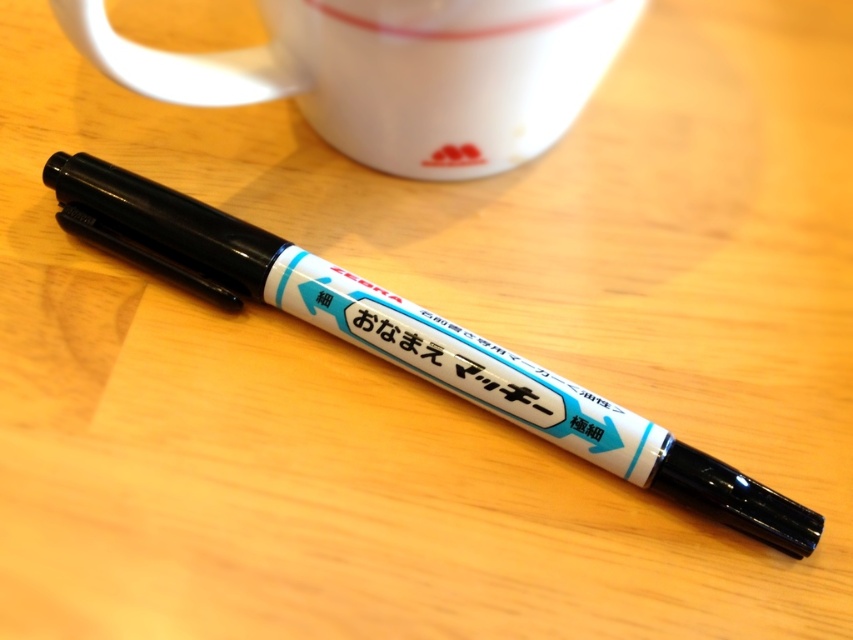
You are organizing a desk and need to place a new item between the white matte mug at upper center and the black plastic marker at center. The new item requires 14 inches of space. Is there enough space between them?

The distance between the white matte mug at upper center and the black plastic marker at center is 12.93 inches. Since the new item requires 14 inches, there is not enough space between them.

You are organizing a desk and need to place both the white matte mug at upper center and the black plastic marker at center. If you want to arrange them so that the taller item is to the left of the shorter one, which object should be placed on the left?

The black plastic marker at center is taller than the white matte mug at upper center, so you should place the black plastic marker at center on the left side to follow the arrangement requirement.